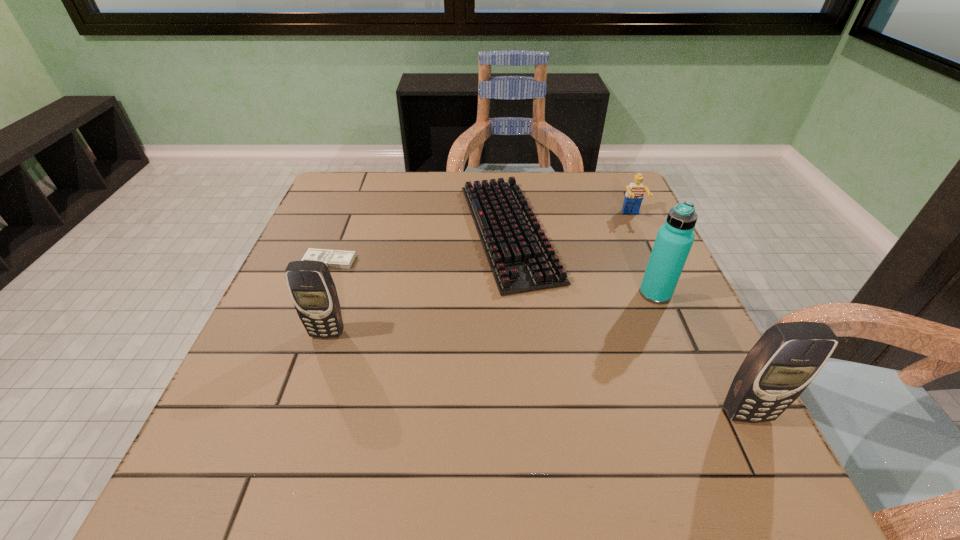
Find the location of `Lego at the right edge`. Lego at the right edge is located at coordinates (634, 195).

Find the location of a particular element. water bottle that is at the right edge is located at coordinates (674, 239).

Identify the location of object that is at the far right corner. (634, 195).

Find the location of a particular element. The image size is (960, 540). object present at the near right corner is located at coordinates (788, 356).

In order to click on vacant space at the far edge of the desktop in this screenshot , I will do `click(419, 178)`.

Where is `vacant region at the left edge`? vacant region at the left edge is located at coordinates (276, 338).

Locate an element on the screen. free point at the right edge is located at coordinates (638, 364).

This screenshot has height=540, width=960. I want to click on free space at the far left corner of the desktop, so (x=362, y=195).

Where is `vacant area at the far right corner`? This screenshot has height=540, width=960. vacant area at the far right corner is located at coordinates (610, 208).

Where is `free space between the fourth object from right to left and the shorter cellular telephone`? free space between the fourth object from right to left and the shorter cellular telephone is located at coordinates (419, 282).